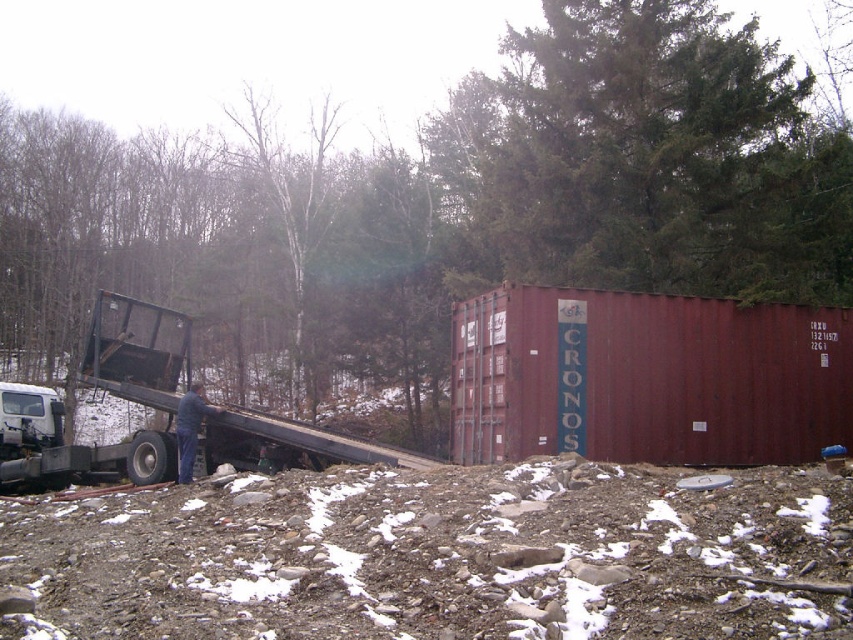
Who is lower down, maroon metal shipping container at right or metallic flatbed truck at left?

Positioned lower is metallic flatbed truck at left.

Between maroon metal shipping container at right and metallic flatbed truck at left, which one is positioned higher?

maroon metal shipping container at right

Is point (653, 340) farther from viewer compared to point (221, 410)?

No, (653, 340) is closer to viewer.

Image resolution: width=853 pixels, height=640 pixels. Find the location of `maroon metal shipping container at right`. maroon metal shipping container at right is located at coordinates (646, 378).

Does metallic truck bed at center appear on the right side of metallic flatbed truck at left?

Indeed, metallic truck bed at center is positioned on the right side of metallic flatbed truck at left.

Consider the image. Is metallic truck bed at center further to the viewer compared to metallic flatbed truck at left?

No.

Where is `metallic truck bed at center`? This screenshot has width=853, height=640. metallic truck bed at center is located at coordinates (485, 497).

Does point (167, 444) come farther from viewer compared to point (451, 397)?

No, it is in front of (451, 397).

What are the coordinates of `metallic truck bed at center` in the screenshot? It's located at (485, 497).